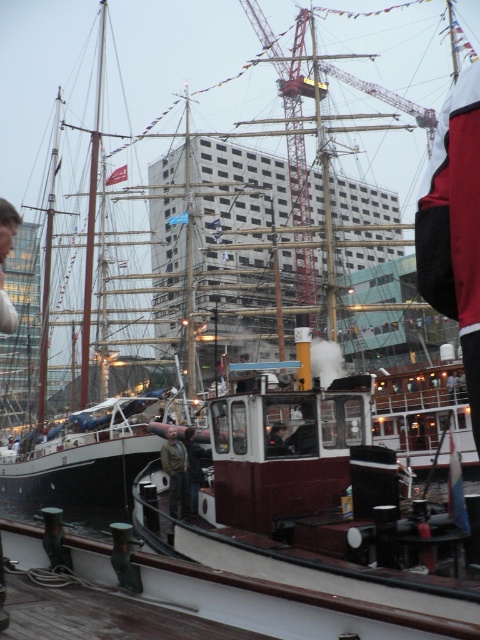
You are standing on the dock and see two people wearing dark blue jeans at center and dark brown leather jacket at center. Which clothing item is located to the left?

The dark blue jeans at center is positioned on the left side of dark brown leather jacket at center.

You are standing on the deck of the large sailing ship and want to determine the visibility of two points marked in the scene. Which point, point 1 at coordinates point [177,436] or point 2 at coordinates point [289,451], is closer to you?

Point 1 at coordinates point [177,436] is closer to you because it is further to the viewer than point 2 at coordinates point [289,451].